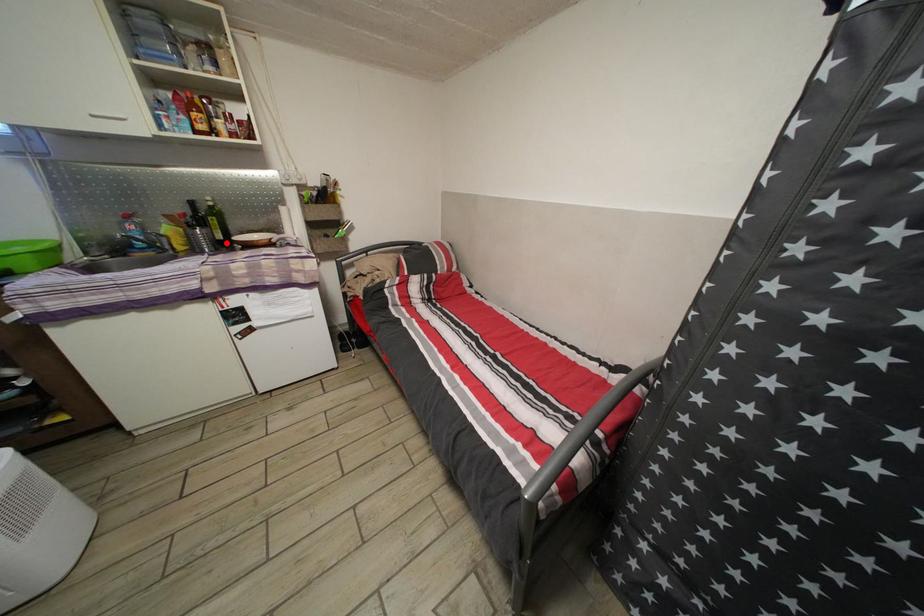
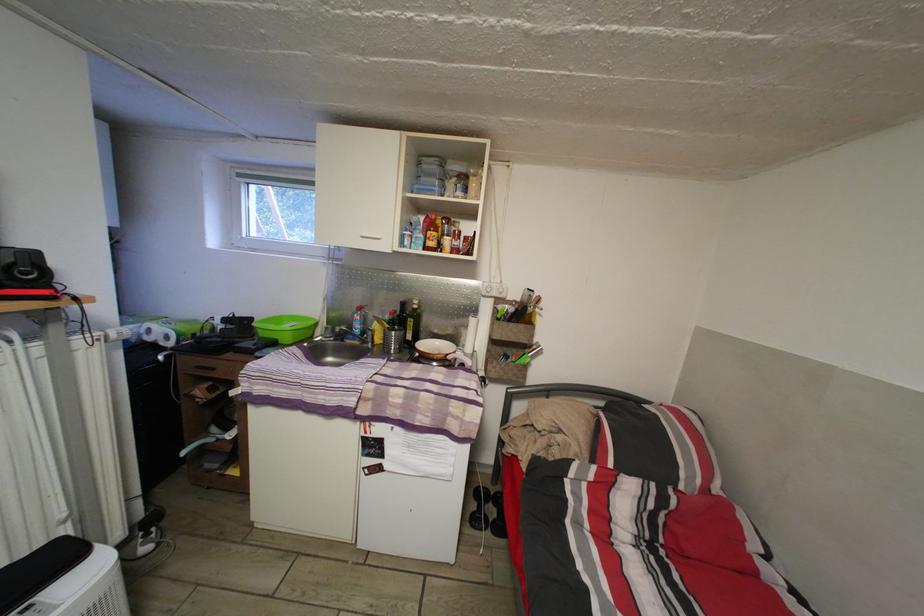
Question: I am providing you with two images of the same scene from different viewpoints. A red point is marked on the first image. Can you still see the location of the red point in image 2?

Choices:
 (A) Yes
 (B) No

Answer: (A)